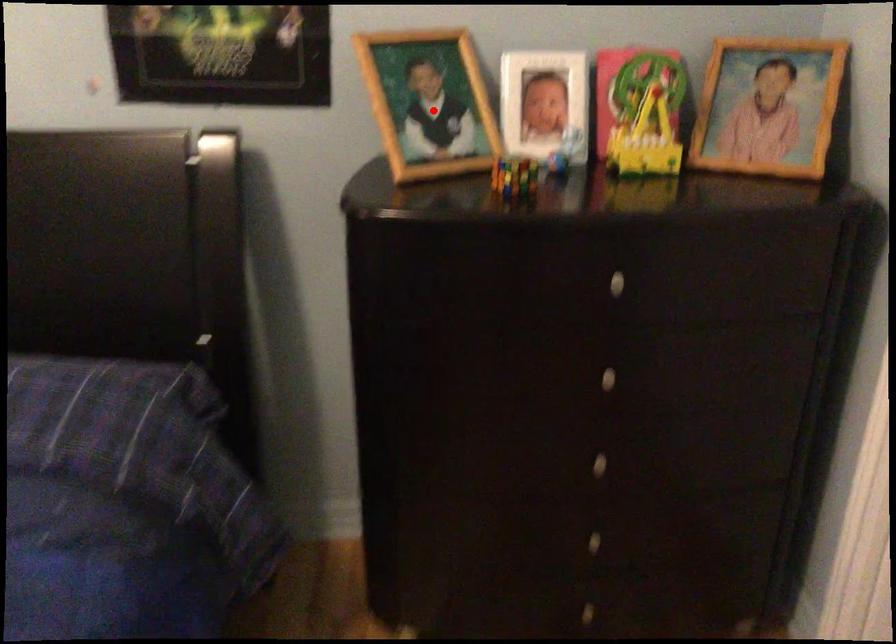
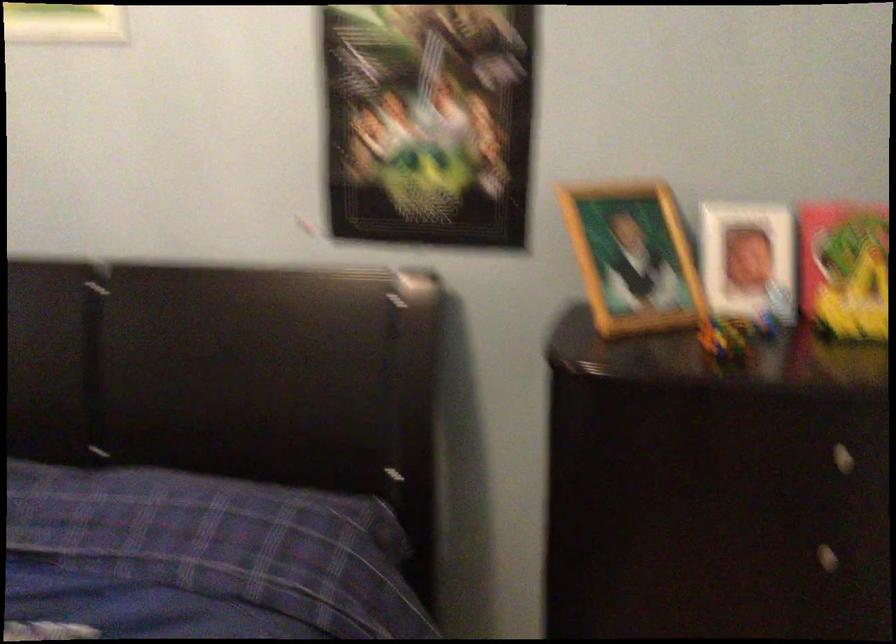
Question: I am providing you with two images of the same scene from different viewpoints. A red point is marked on the first image. Is the red point's position out of view in image 2?

Choices:
 (A) Yes
 (B) No

Answer: (B)